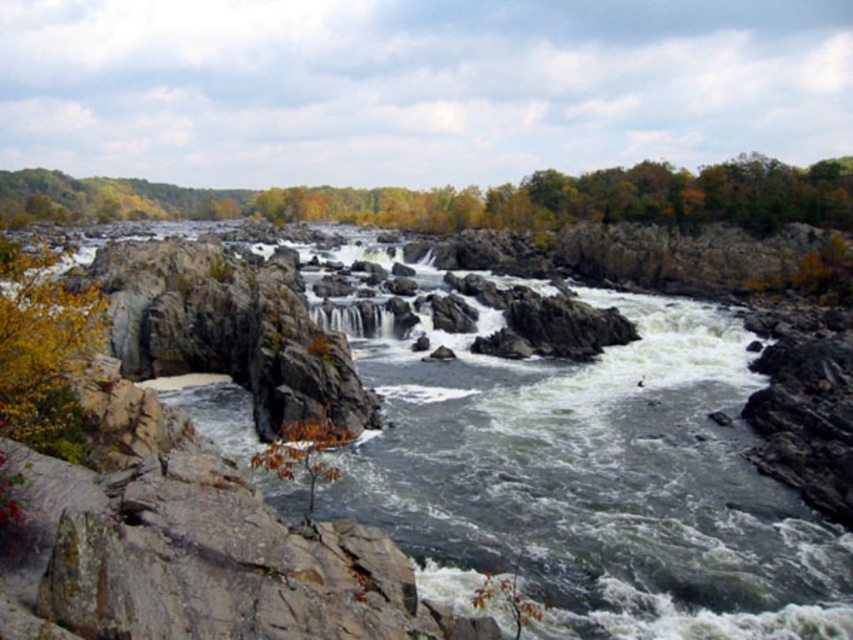
Question: Which object is farther from the camera taking this photo?

Choices:
 (A) white textured water at center
 (B) green leafy tree at upper center
 (C) orange leafy tree at lower center

Answer: (B)

Question: Can you confirm if green leafy tree at upper center is bigger than orange leafy tree at lower center?

Choices:
 (A) no
 (B) yes

Answer: (B)

Question: Where is orange leafy tree at lower center located in relation to white textured water at center in the image?

Choices:
 (A) left
 (B) right

Answer: (B)

Question: Which object is closer to the camera taking this photo?

Choices:
 (A) green leafy tree at upper center
 (B) white textured water at center
 (C) orange leafy tree at lower center

Answer: (C)

Question: Does green leafy tree at upper center have a greater width compared to white textured water at center?

Choices:
 (A) no
 (B) yes

Answer: (B)

Question: Which is farther from the orange leafy tree at lower center?

Choices:
 (A) white textured water at center
 (B) green leafy tree at upper center

Answer: (B)